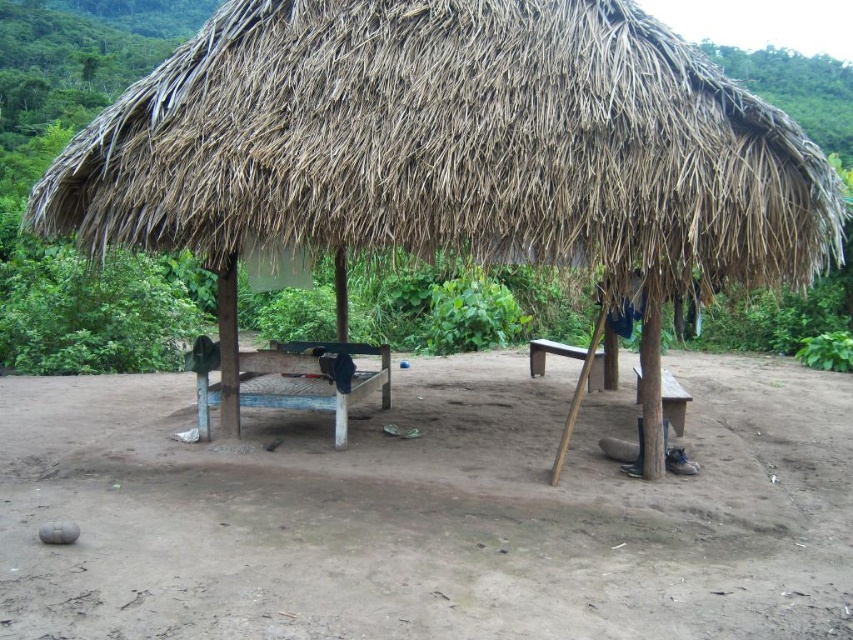
You are a gardener standing on the brown dirt field at center. You want to reach the dry straw roof at upper center to inspect it for damage. Can you safely reach the roof without any tools?

The distance between the brown dirt field at center and the dry straw roof at upper center is 2.37 meters. Since this distance is greater than the average person can jump or reach, you cannot safely reach the roof without tools.